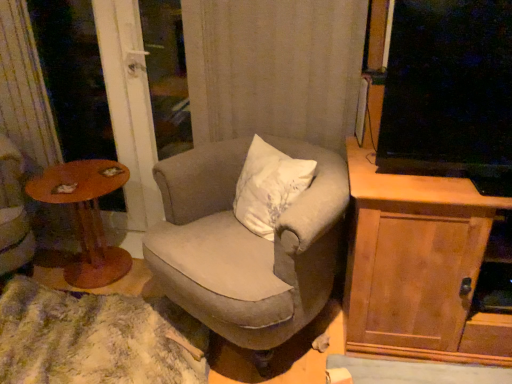
Question: In the image, is fuzzy carpet at lower left positioned in front of or behind textured beige armchair at center?

Choices:
 (A) front
 (B) behind

Answer: (B)

Question: Which is correct: fuzzy carpet at lower left is inside textured beige armchair at center, or outside of it?

Choices:
 (A) outside
 (B) inside

Answer: (A)

Question: Estimate the real-world distances between objects in this image. Which object is farther from the textured beige armchair at center?

Choices:
 (A) wooden cabinet at right
 (B) wooden round table at left
 (C) transparent glass screen door at left
 (D) fuzzy carpet at lower left

Answer: (C)

Question: Considering the real-world distances, which object is closest to the textured beige armchair at center?

Choices:
 (A) wooden cabinet at right
 (B) fuzzy carpet at lower left
 (C) wooden round table at left
 (D) transparent glass screen door at left

Answer: (A)